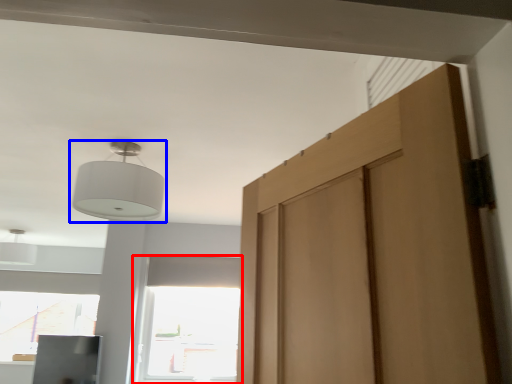
Question: Among these objects, which one is nearest to the camera, window (highlighted by a red box) or lamp (highlighted by a blue box)?

Choices:
 (A) window
 (B) lamp

Answer: (B)